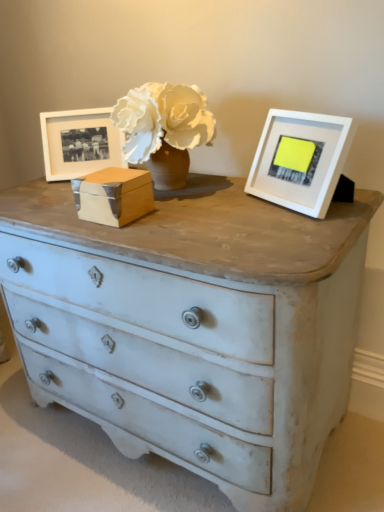
Question: Is wooden box at center next to matte white picture frame at left, marked as the 2th picture frame in a right-to-left arrangement?

Choices:
 (A) no
 (B) yes

Answer: (A)

Question: Is wooden box at center not near matte white picture frame at left, the first picture frame from the back?

Choices:
 (A) yes
 (B) no

Answer: (B)

Question: Does wooden box at center come in front of matte white picture frame at left, marked as the 2th picture frame in a right-to-left arrangement?

Choices:
 (A) yes
 (B) no

Answer: (A)

Question: From the image's perspective, is wooden box at center over matte white picture frame at left, which is counted as the 1th picture frame, starting from the left?

Choices:
 (A) yes
 (B) no

Answer: (B)

Question: Does wooden box at center have a lesser width compared to matte white picture frame at left, which is counted as the 1th picture frame, starting from the left?

Choices:
 (A) no
 (B) yes

Answer: (A)

Question: In the image, is white matte picture frame at upper right, the first picture frame in the front-to-back sequence, positioned in front of or behind matte white picture frame at left, which is counted as the 1th picture frame, starting from the left?

Choices:
 (A) behind
 (B) front

Answer: (B)

Question: Would you say white matte picture frame at upper right, the 1th picture frame from the right, is to the left or to the right of matte white picture frame at left, the first picture frame from the back, in the picture?

Choices:
 (A) left
 (B) right

Answer: (B)

Question: From a real-world perspective, is white matte picture frame at upper right, the 1th picture frame from the right, positioned above or below matte white picture frame at left, marked as the 2th picture frame in a right-to-left arrangement?

Choices:
 (A) below
 (B) above

Answer: (A)

Question: In terms of width, does white matte picture frame at upper right, the second picture frame viewed from the left, look wider or thinner when compared to matte white picture frame at left, the 2th picture frame from the front?

Choices:
 (A) thin
 (B) wide

Answer: (B)

Question: Looking at their shapes, would you say matte white picture frame at left, the 2th picture frame from the front, is wider or thinner than wooden box at center?

Choices:
 (A) wide
 (B) thin

Answer: (B)

Question: Based on their sizes in the image, would you say matte white picture frame at left, marked as the 2th picture frame in a right-to-left arrangement, is bigger or smaller than wooden box at center?

Choices:
 (A) small
 (B) big

Answer: (B)

Question: From a real-world perspective, relative to wooden box at center, is matte white picture frame at left, the 2th picture frame from the front, vertically above or below?

Choices:
 (A) above
 (B) below

Answer: (A)

Question: Do you think matte white picture frame at left, which is counted as the 1th picture frame, starting from the left, is within wooden box at center, or outside of it?

Choices:
 (A) outside
 (B) inside

Answer: (A)

Question: Looking at the image, does white matte picture frame at upper right, the first picture frame in the front-to-back sequence, seem bigger or smaller compared to wooden box at center?

Choices:
 (A) small
 (B) big

Answer: (B)

Question: Is white matte picture frame at upper right, which is the second picture frame from back to front, to the left or to the right of wooden box at center in the image?

Choices:
 (A) right
 (B) left

Answer: (A)